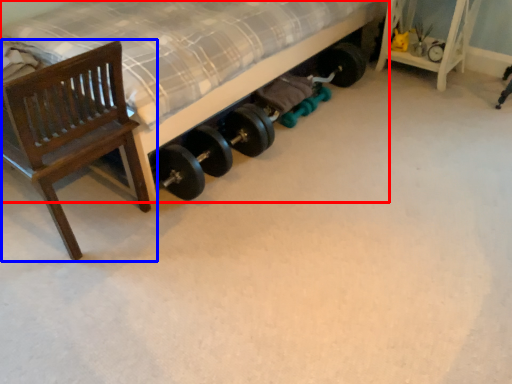
Question: Which object is closer to the camera taking this photo, bed (highlighted by a red box) or chair (highlighted by a blue box)?

Choices:
 (A) bed
 (B) chair

Answer: (B)